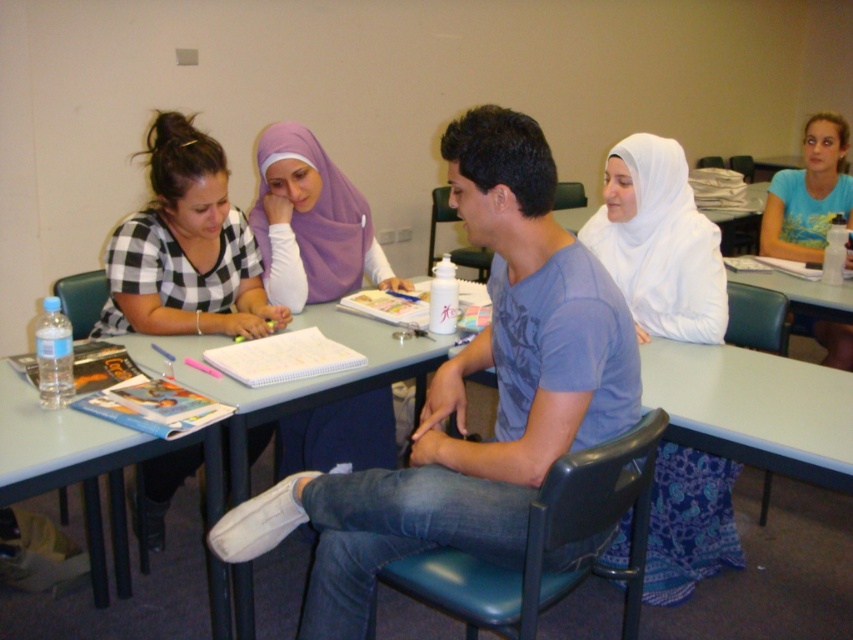
Who is more distant from viewer, (x=247, y=536) or (x=241, y=584)?

The point (x=241, y=584) is behind.

Is blue cotton shirt at center positioned before light blue plastic table at center?

Yes.

Is point (376, 500) farther from viewer compared to point (35, 438)?

No, it is in front of (35, 438).

You are a GUI agent. You are given a task and a screenshot of the screen. Output one action in this format:
    pyautogui.click(x=<x>, y=<y>)
    Task: Click on the blue cotton shirt at center
    This screenshot has width=853, height=640.
    Given the screenshot: What is the action you would take?
    pyautogui.click(x=463, y=396)

Who is more forward, (242, 280) or (840, 186)?

Positioned in front is point (242, 280).

Is point (167, 163) closer to camera compared to point (807, 179)?

Yes, it is.

Locate an element on the screen. This screenshot has width=853, height=640. black checkered shirt at upper left is located at coordinates (184, 248).

Can you confirm if white fabric hijab at center is thinner than purple fabric hijab at upper center?

Correct, white fabric hijab at center's width is less than purple fabric hijab at upper center's.

Who is higher up, white fabric hijab at center or purple fabric hijab at upper center?

purple fabric hijab at upper center is above.

Where is `white fabric hijab at center`? The image size is (853, 640). white fabric hijab at center is located at coordinates (659, 243).